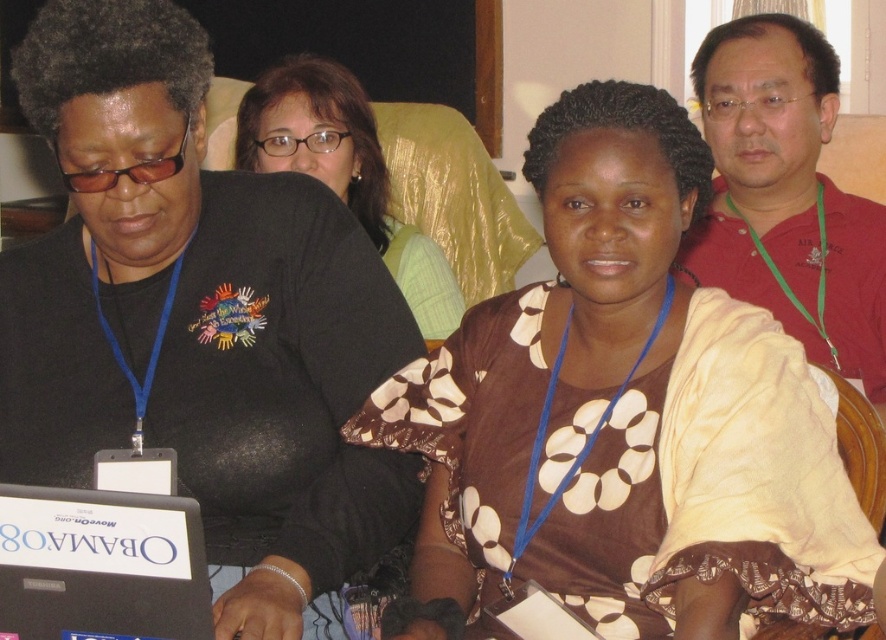
The width and height of the screenshot is (886, 640). Describe the element at coordinates (623, 417) in the screenshot. I see `brown dotted blouse at center` at that location.

Can you confirm if brown dotted blouse at center is bigger than red shirt at upper right?

Indeed, brown dotted blouse at center has a larger size compared to red shirt at upper right.

You are a GUI agent. You are given a task and a screenshot of the screen. Output one action in this format:
    pyautogui.click(x=<x>, y=<y>)
    Task: Click on the brown dotted blouse at center
    The image size is (886, 640).
    Given the screenshot: What is the action you would take?
    pyautogui.click(x=623, y=417)

Between point (701, 618) and point (137, 518), which one is positioned in front?

Point (137, 518) is in front.

Is brown dotted blouse at center closer to camera compared to black plastic laptop at lower left?

No, brown dotted blouse at center is further to the viewer.

Is point (812, 436) positioned before point (207, 625)?

No, (812, 436) is further to viewer.

The width and height of the screenshot is (886, 640). I want to click on brown dotted blouse at center, so click(623, 417).

Identify the location of brown dotted blouse at center. (623, 417).